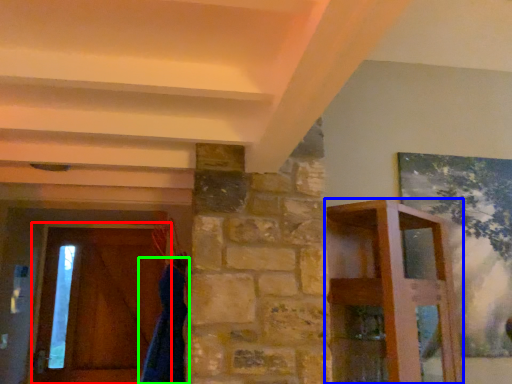
Question: Which object is positioned closest to barn door (highlighted by a red box)? Select from furniture (highlighted by a blue box) and robe (highlighted by a green box).

Choices:
 (A) furniture
 (B) robe

Answer: (B)